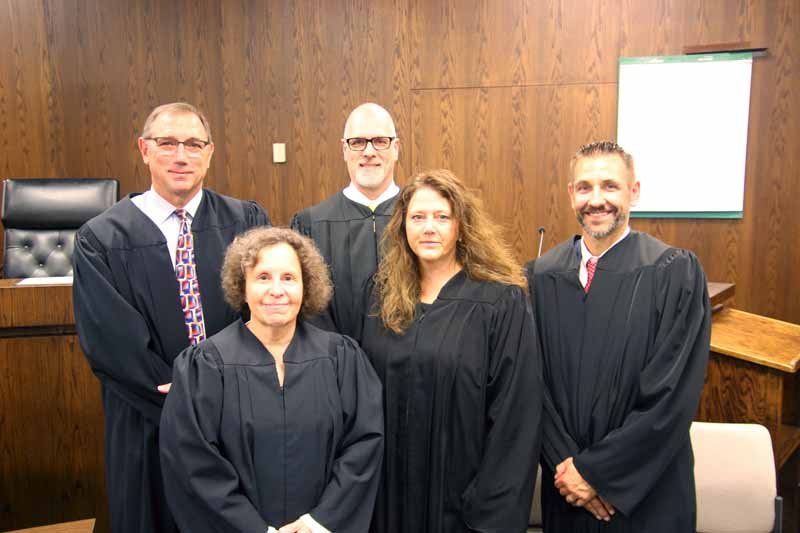
Where is `wall`? wall is located at coordinates (454, 69).